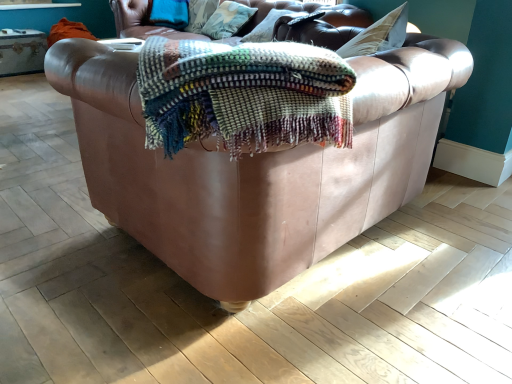
Question: From the image's perspective, is leather couch at center above or below textured cotton pillow at upper center, acting as the first pillow starting from the left?

Choices:
 (A) above
 (B) below

Answer: (B)

Question: Is leather couch at center wider or thinner than textured cotton pillow at upper center, acting as the first pillow starting from the left?

Choices:
 (A) wide
 (B) thin

Answer: (A)

Question: Estimate the real-world distances between objects in this image. Which object is farther from the textured cotton pillow at upper center, acting as the first pillow starting from the left?

Choices:
 (A) velvet cushion at upper center, the 1th pillow from the right
 (B) leather couch at center

Answer: (B)

Question: Based on their relative distances, which object is nearer to the textured cotton pillow at upper center, acting as the first pillow starting from the left?

Choices:
 (A) velvet cushion at upper center, the 1th pillow from the right
 (B) leather couch at center

Answer: (A)